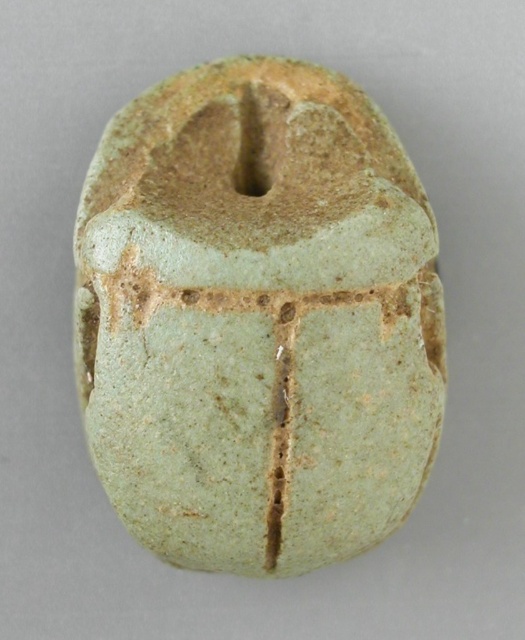
You are an archaeologist examining the artifact. You notice two versions of the scarab depicted here. Which one is closer to you, the green stone scarab at center or the green cracked scarab at center?

The green stone scarab at center is closer to you because it is in front of the green cracked scarab at center.

You are an archaeologist examining two artifacts in a museum display case. You have a ruler that can measure up to 10 centimeters. The first artifact is the green stone scarab at center, and the second is the green cracked scarab at center. Which artifact should you measure first if you want to determine which one is wider?

You should measure the green stone scarab at center first because the description states it might be wider than the green cracked scarab at center, so verifying its width will help determine which is wider.

You are an archaeologist examining two ancient scarab artifacts displayed in a museum case. You notice a green stone scarab at center and a green cracked scarab at center. Which one is located to the left?

The green stone scarab at center is positioned to the left of the green cracked scarab at center.